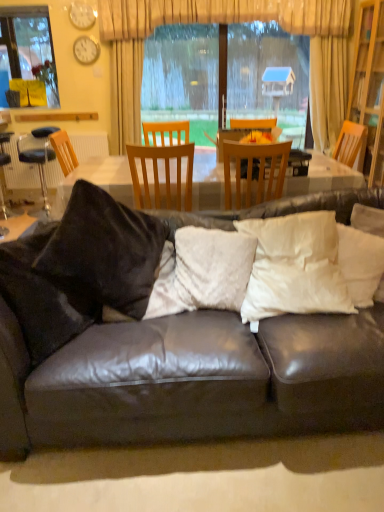
Question: Is wooden bookshelf at right outside matte white clock at upper left, which is the first clock in bottom-to-top order?

Choices:
 (A) no
 (B) yes

Answer: (B)

Question: From the image's perspective, is wooden bookshelf at right on matte white clock at upper left, which is the first clock in bottom-to-top order?

Choices:
 (A) no
 (B) yes

Answer: (A)

Question: Is wooden bookshelf at right oriented away from matte white clock at upper left, which is the first clock in bottom-to-top order?

Choices:
 (A) no
 (B) yes

Answer: (A)

Question: Can you confirm if wooden bookshelf at right is positioned to the right of matte white clock at upper left, the 2th clock when ordered from top to bottom?

Choices:
 (A) no
 (B) yes

Answer: (B)

Question: Is wooden bookshelf at right surrounding matte white clock at upper left, which is the first clock in bottom-to-top order?

Choices:
 (A) yes
 (B) no

Answer: (B)

Question: Is wooden bookshelf at right positioned far away from matte white clock at upper left, the 2th clock when ordered from top to bottom?

Choices:
 (A) yes
 (B) no

Answer: (A)

Question: From a real-world perspective, is leather couch with pillows at center physically below wooden chair at center, acting as the second chair starting from the right?

Choices:
 (A) no
 (B) yes

Answer: (B)

Question: Is leather couch with pillows at center completely or partially outside of wooden chair at center, arranged as the 1th chair when viewed from the left?

Choices:
 (A) yes
 (B) no

Answer: (A)

Question: Considering the relative sizes of leather couch with pillows at center and wooden chair at center, arranged as the 1th chair when viewed from the left, in the image provided, is leather couch with pillows at center bigger than wooden chair at center, arranged as the 1th chair when viewed from the left,?

Choices:
 (A) no
 (B) yes

Answer: (B)

Question: Considering the relative positions of leather couch with pillows at center and wooden chair at center, arranged as the 1th chair when viewed from the left, in the image provided, is leather couch with pillows at center to the left of wooden chair at center, arranged as the 1th chair when viewed from the left, from the viewer's perspective?

Choices:
 (A) yes
 (B) no

Answer: (B)

Question: From the image's perspective, would you say leather couch with pillows at center is shown under wooden chair at center, acting as the second chair starting from the right?

Choices:
 (A) yes
 (B) no

Answer: (A)

Question: From a real-world perspective, does leather couch with pillows at center stand above wooden chair at center, acting as the second chair starting from the right?

Choices:
 (A) no
 (B) yes

Answer: (A)

Question: Is beige fabric curtain at upper center taller than black leather bar stool at left?

Choices:
 (A) no
 (B) yes

Answer: (B)